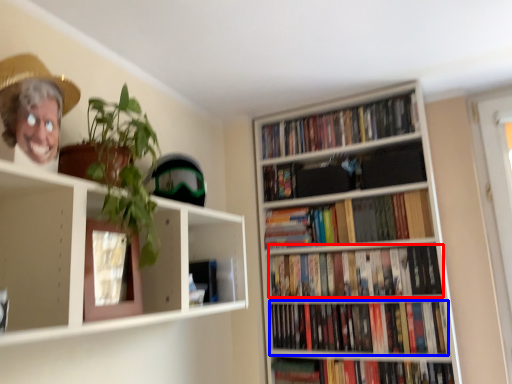
Question: Which of the following is the closest to the observer, book (highlighted by a red box) or book (highlighted by a blue box)?

Choices:
 (A) book
 (B) book

Answer: (B)